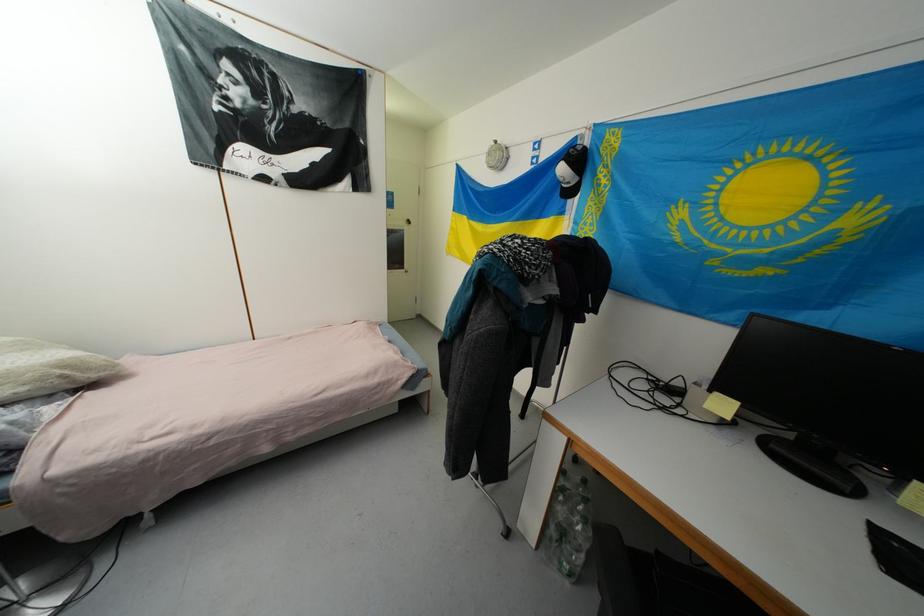
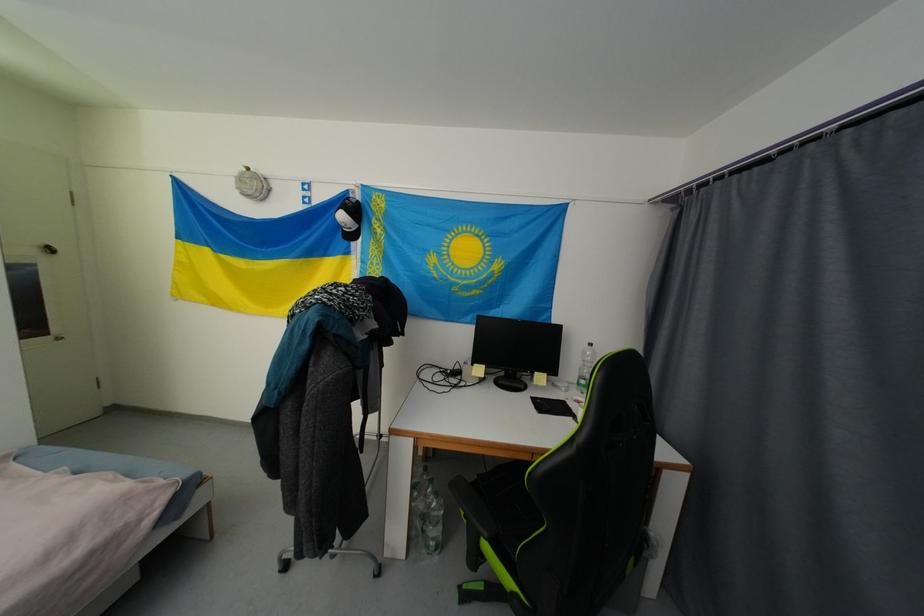
In the second image, find the point that corresponds to [586,150] in the first image.

(359, 203)